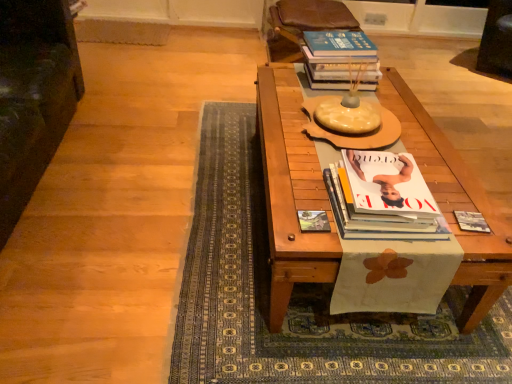
The width and height of the screenshot is (512, 384). Identify the location of empty space that is ontop of white glossy magazine at center, which is counted as the 2th book, starting from the bottom (from a real-world perspective). (379, 182).